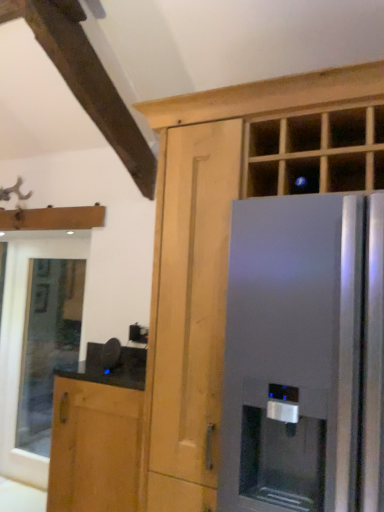
Question: From the image's perspective, relative to matte wood cabinet at center, marked as the 2th cabinetry in a left-to-right arrangement, is clear glass window at lower left above or below?

Choices:
 (A) below
 (B) above

Answer: (A)

Question: Considering the relative positions of clear glass window at lower left and matte wood cabinet at center, marked as the 2th cabinetry in a left-to-right arrangement, in the image provided, is clear glass window at lower left to the left or to the right of matte wood cabinet at center, marked as the 2th cabinetry in a left-to-right arrangement,?

Choices:
 (A) left
 (B) right

Answer: (A)

Question: Which object is positioned farthest from the clear glass window at lower left?

Choices:
 (A) brown wood cabinet at lower left, acting as the 1th cabinetry starting from the left
 (B) satin silver refrigerator at right
 (C) matte wood cabinet at center, which is the first cabinetry from right to left

Answer: (B)

Question: Estimate the real-world distances between objects in this image. Which object is closer to the brown wood cabinet at lower left, acting as the 1th cabinetry starting from the left?

Choices:
 (A) clear glass window at lower left
 (B) satin silver refrigerator at right
 (C) matte wood cabinet at center, which is the first cabinetry from right to left

Answer: (C)